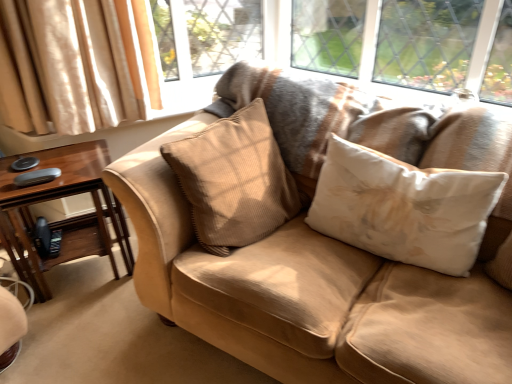
Question: Does white fabric pillow at center, acting as the 2th pillow starting from the left, lie behind suede couch at center?

Choices:
 (A) no
 (B) yes

Answer: (B)

Question: Is white fabric pillow at center, acting as the 2th pillow starting from the left, looking in the opposite direction of suede couch at center?

Choices:
 (A) yes
 (B) no

Answer: (A)

Question: Is white fabric pillow at center, acting as the 2th pillow starting from the left, wider than suede couch at center?

Choices:
 (A) yes
 (B) no

Answer: (B)

Question: Considering the relative sizes of white fabric pillow at center, acting as the 2th pillow starting from the left, and suede couch at center in the image provided, is white fabric pillow at center, acting as the 2th pillow starting from the left, smaller than suede couch at center?

Choices:
 (A) no
 (B) yes

Answer: (B)

Question: Is white fabric pillow at center, acting as the 2th pillow starting from the left, to the left of suede couch at center from the viewer's perspective?

Choices:
 (A) no
 (B) yes

Answer: (A)

Question: Is white fabric pillow at center, acting as the 2th pillow starting from the left, next to suede couch at center?

Choices:
 (A) yes
 (B) no

Answer: (B)

Question: From the image's perspective, is suede couch at center on white fabric pillow at center, acting as the 2th pillow starting from the left?

Choices:
 (A) yes
 (B) no

Answer: (B)

Question: Considering the relative positions of suede couch at center and white fabric pillow at center, which is the first pillow from right to left, in the image provided, is suede couch at center behind white fabric pillow at center, which is the first pillow from right to left,?

Choices:
 (A) yes
 (B) no

Answer: (B)

Question: Can you confirm if suede couch at center is thinner than white fabric pillow at center, acting as the 2th pillow starting from the left?

Choices:
 (A) no
 (B) yes

Answer: (A)

Question: Is suede couch at center wider than white fabric pillow at center, acting as the 2th pillow starting from the left?

Choices:
 (A) no
 (B) yes

Answer: (B)

Question: Could you tell me if suede couch at center is turned towards white fabric pillow at center, which is the first pillow from right to left?

Choices:
 (A) no
 (B) yes

Answer: (B)

Question: Does suede couch at center appear on the left side of white fabric pillow at center, which is the first pillow from right to left?

Choices:
 (A) yes
 (B) no

Answer: (A)

Question: Is brown wood table at left closer to the viewer compared to white fabric pillow at center, which is the first pillow from right to left?

Choices:
 (A) no
 (B) yes

Answer: (A)